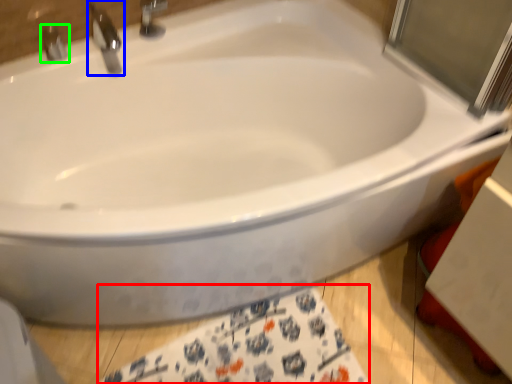
Question: Based on their relative distances, which object is nearer to bath towel (highlighted by a red box)? Choose from tap (highlighted by a blue box) and tap (highlighted by a green box).

Choices:
 (A) tap
 (B) tap

Answer: (A)